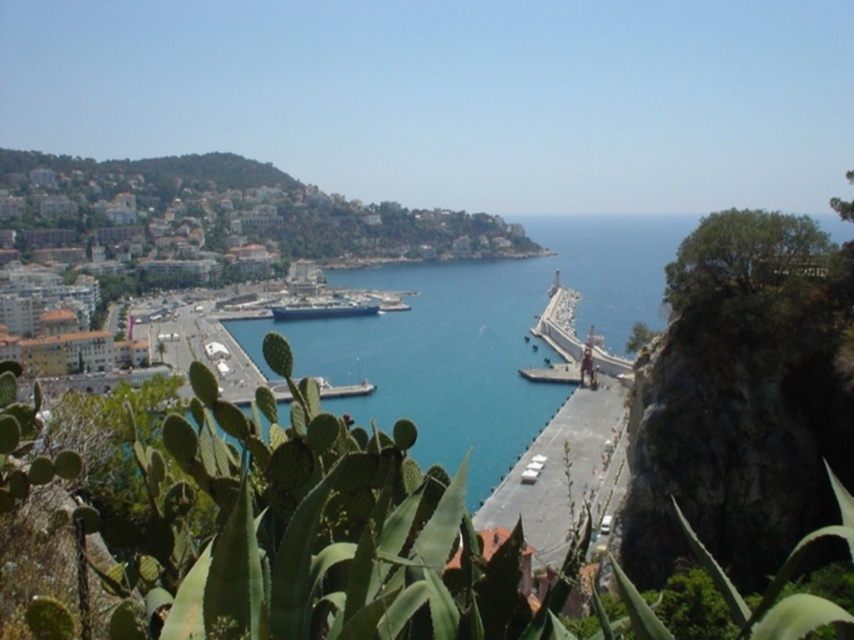
From the picture: Does green spiny cactus at lower left have a greater height compared to blue water at center?

No, green spiny cactus at lower left is not taller than blue water at center.

Can you confirm if green spiny cactus at lower left is positioned to the left of blue water at center?

No, green spiny cactus at lower left is not to the left of blue water at center.

At what (x,y) coordinates should I click in order to perform the action: click on green spiny cactus at lower left. Please return your answer as a coordinate pair (x, y). Looking at the image, I should click on (311, 536).

At what (x,y) coordinates should I click in order to perform the action: click on green spiny cactus at lower left. Please return your answer as a coordinate pair (x, y). Looking at the image, I should click on (311, 536).

Looking at this image, is green spiny cactus at lower left positioned before blue metallic cruise ship at center?

Yes, it is.

Between point (285, 369) and point (279, 314), which one is positioned in front?

Point (285, 369)

The image size is (854, 640). Describe the element at coordinates (311, 536) in the screenshot. I see `green spiny cactus at lower left` at that location.

Find the location of a particular element. The height and width of the screenshot is (640, 854). green spiny cactus at lower left is located at coordinates (311, 536).

Which is above, blue water at center or blue metallic cruise ship at center?

blue metallic cruise ship at center is above.

Does blue water at center lie behind blue metallic cruise ship at center?

No.

Where is `blue water at center`? The width and height of the screenshot is (854, 640). blue water at center is located at coordinates (436, 358).